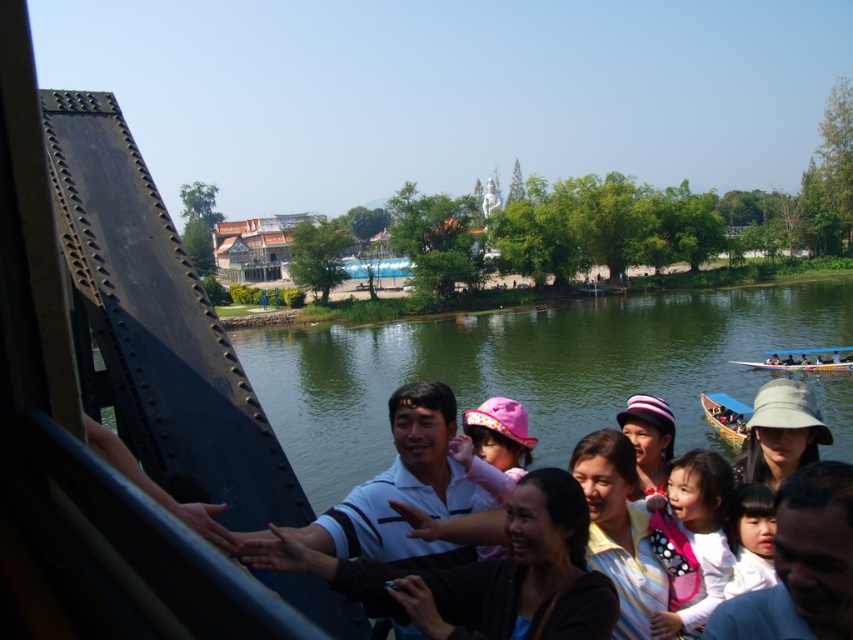
Please look at the image. There is a point at coordinate (480, 573). What object is located at that point?

The point at coordinate (480, 573) indicates a matte white shirt at center.

From the picture: You are standing at point A which is at coordinates point A at [753,557]. You want to reach point B which is at coordinates point B at 0.721, 0.456. The distance between them is 37.92 feet. Can you walk directly from point A to point B without crossing the river?

→ The distance between point A at [753,557] and point B at 0.721, 0.456 is 37.92 feet. Since the river is in between, you cannot walk directly from point A to point B without crossing the river.